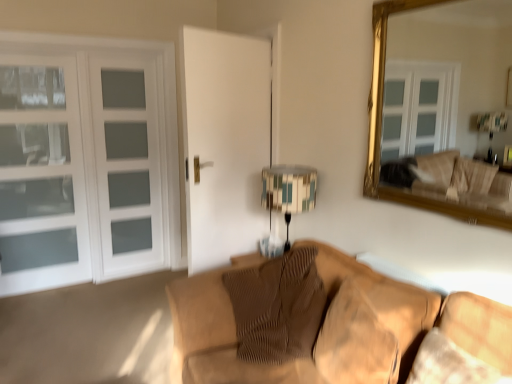
Question: Is patterned fabric lampshade at center facing away from textured beige swivel chair at lower right?

Choices:
 (A) no
 (B) yes

Answer: (A)

Question: Is patterned fabric lampshade at center in front of textured beige swivel chair at lower right?

Choices:
 (A) yes
 (B) no

Answer: (B)

Question: Does patterned fabric lampshade at center appear on the right side of textured beige swivel chair at lower right?

Choices:
 (A) no
 (B) yes

Answer: (A)

Question: Does patterned fabric lampshade at center have a greater height compared to textured beige swivel chair at lower right?

Choices:
 (A) yes
 (B) no

Answer: (A)

Question: Is patterned fabric lampshade at center smaller than textured beige swivel chair at lower right?

Choices:
 (A) yes
 (B) no

Answer: (B)

Question: Is patterned fabric lampshade at center bigger than textured beige swivel chair at lower right?

Choices:
 (A) yes
 (B) no

Answer: (A)

Question: Is white glass screen door at left surrounded by white glass cabinet at left?

Choices:
 (A) yes
 (B) no

Answer: (B)

Question: Is white glass cabinet at left next to white glass screen door at left and touching it?

Choices:
 (A) yes
 (B) no

Answer: (B)

Question: From a real-world perspective, is white glass cabinet at left on white glass screen door at left?

Choices:
 (A) no
 (B) yes

Answer: (A)

Question: Is white glass cabinet at left oriented towards white glass screen door at left?

Choices:
 (A) no
 (B) yes

Answer: (A)

Question: Does white glass cabinet at left have a greater width compared to white glass screen door at left?

Choices:
 (A) yes
 (B) no

Answer: (B)

Question: From the image's perspective, is white glass cabinet at left on white glass screen door at left?

Choices:
 (A) no
 (B) yes

Answer: (A)

Question: Is patterned fabric lampshade at center at the back of white glass door at left?

Choices:
 (A) no
 (B) yes

Answer: (A)